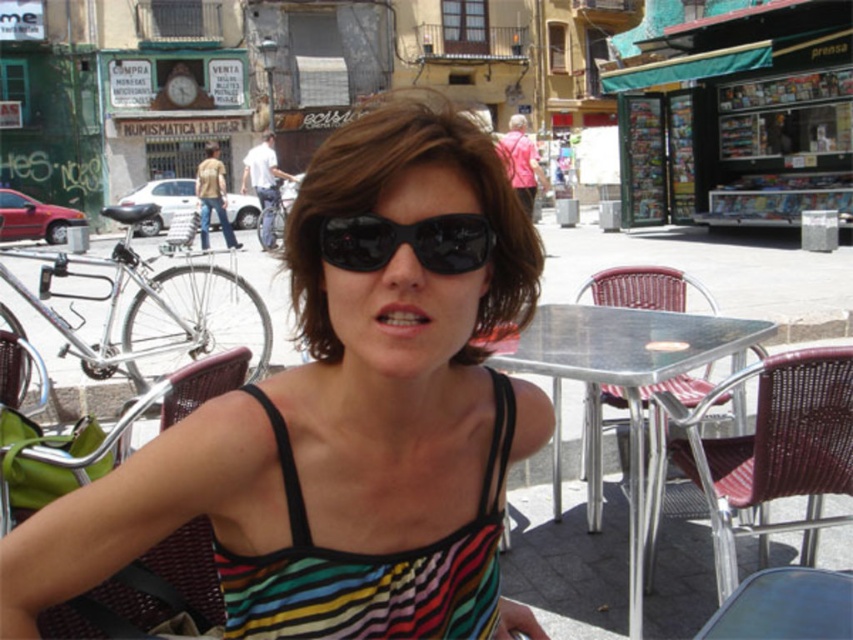
Is striped fabric dress at center to the left of woven brown chair at lower left from the viewer's perspective?

Incorrect, striped fabric dress at center is not on the left side of woven brown chair at lower left.

Is striped fabric dress at center further to camera compared to woven brown chair at lower left?

No.

Measure the distance between point (494, 529) and camera.

Point (494, 529) is 2.00 meters from camera.

Locate an element on the screen. striped fabric dress at center is located at coordinates (370, 564).

Who is positioned more to the right, woven brown chair at lower right or metallic silver table at center?

woven brown chair at lower right is more to the right.

What do you see at coordinates (764, 452) in the screenshot? I see `woven brown chair at lower right` at bounding box center [764, 452].

Which is behind, point (665, 436) or point (608, 321)?

The point (608, 321) is behind.

The height and width of the screenshot is (640, 853). I want to click on woven brown chair at lower right, so click(x=764, y=452).

Who is lower down, metallic silver table at center or metallic silver chair at center?

metallic silver chair at center is lower down.

Between metallic silver table at center and metallic silver chair at center, which one appears on the left side from the viewer's perspective?

metallic silver table at center

The image size is (853, 640). I want to click on metallic silver table at center, so click(619, 387).

Identify the location of metallic silver table at center. (619, 387).